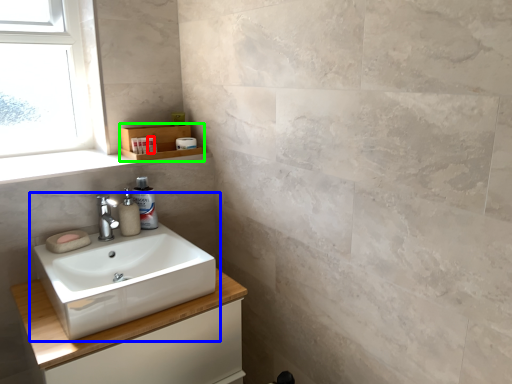
Question: Which is farther away from toiletry (highlighted by a red box)? sink (highlighted by a blue box) or shelf (highlighted by a green box)?

Choices:
 (A) sink
 (B) shelf

Answer: (A)